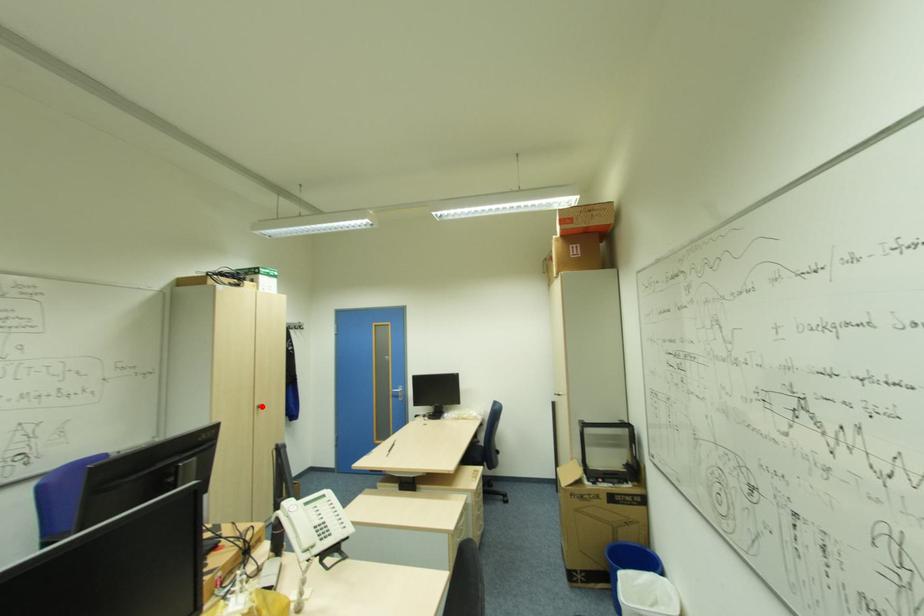
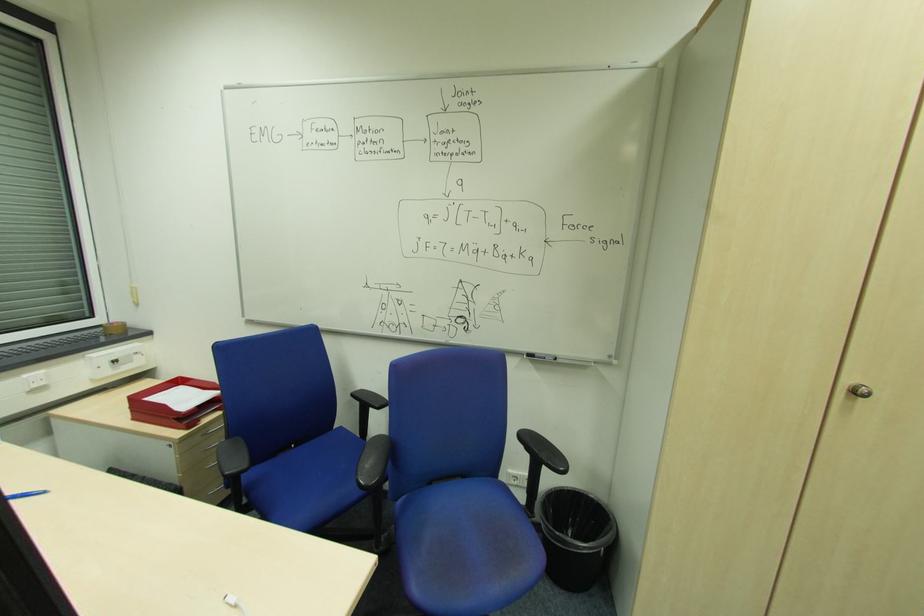
Locate, in the second image, the point that corresponds to the highlighted location in the first image.

(860, 392)